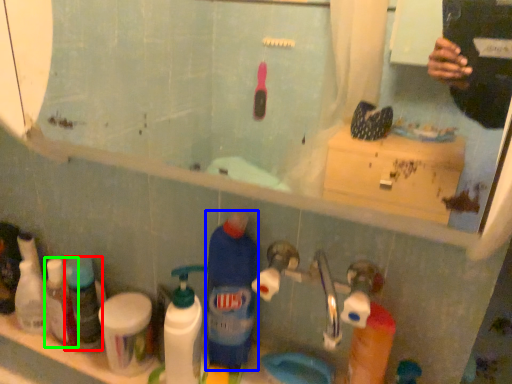
Question: Which is farther away from toiletry (highlighted by a red box)? cleaning product (highlighted by a blue box) or toiletry (highlighted by a green box)?

Choices:
 (A) cleaning product
 (B) toiletry

Answer: (A)